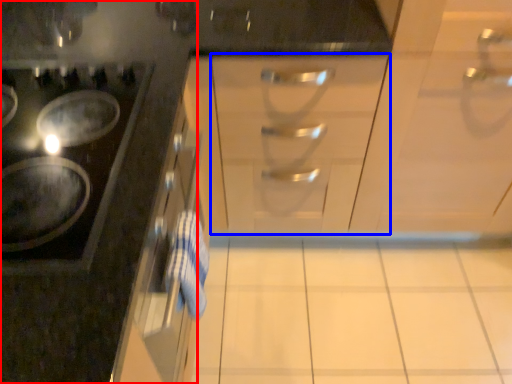
Question: Which of the following is the closest to the observer, cabinetry (highlighted by a red box) or drawer (highlighted by a blue box)?

Choices:
 (A) cabinetry
 (B) drawer

Answer: (A)